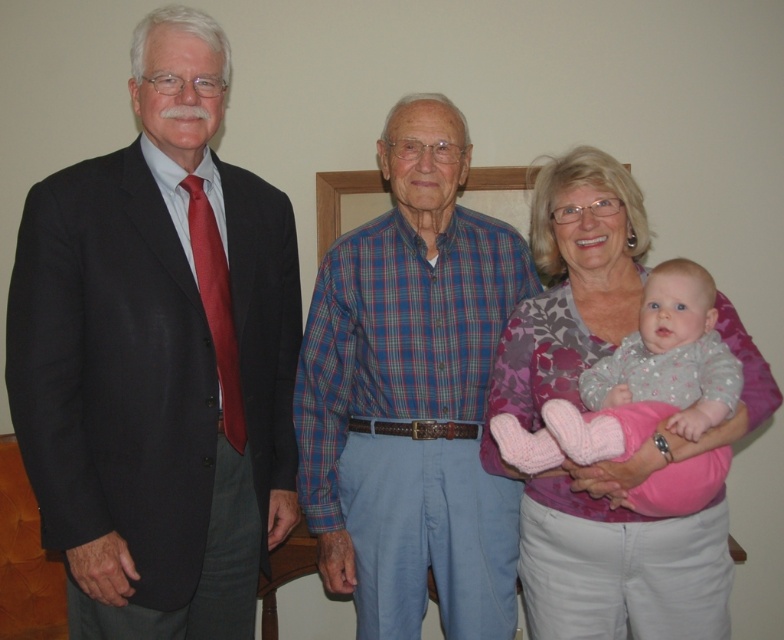
Question: Is matte black suit at left bigger than fluffy pink socks at center?

Choices:
 (A) yes
 (B) no

Answer: (A)

Question: Which point is closer to the camera?

Choices:
 (A) (414, 276)
 (B) (567, 541)
 (C) (630, 451)

Answer: (C)

Question: Is blue plaid shirt at center smaller than floral fabric shirt at center?

Choices:
 (A) no
 (B) yes

Answer: (B)

Question: Which object appears farthest from the camera in this image?

Choices:
 (A) matte black suit at left
 (B) fluffy pink socks at center
 (C) floral fabric shirt at center
 (D) blue plaid shirt at center

Answer: (D)

Question: Among these objects, which one is nearest to the camera?

Choices:
 (A) floral fabric shirt at center
 (B) matte black suit at left

Answer: (B)

Question: Is matte black suit at left below floral fabric shirt at center?

Choices:
 (A) no
 (B) yes

Answer: (A)